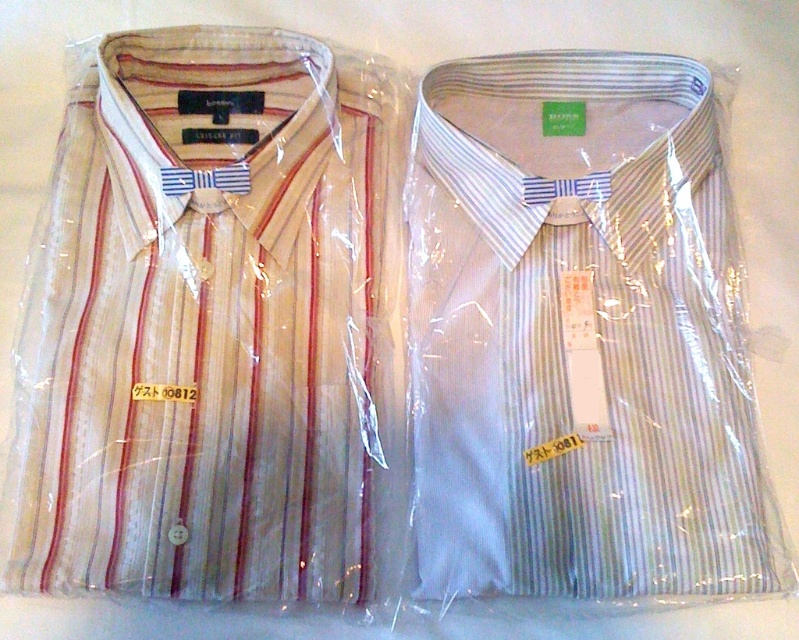
Question: Is white striped shirt at left bigger than light blue striped shirt at center?

Choices:
 (A) no
 (B) yes

Answer: (B)

Question: Is white striped shirt at left in front of light blue striped shirt at center?

Choices:
 (A) yes
 (B) no

Answer: (A)

Question: Which point is farther to the camera?

Choices:
 (A) (138, 516)
 (B) (464, 424)

Answer: (B)

Question: Is white striped shirt at left positioned at the back of light blue striped shirt at center?

Choices:
 (A) yes
 (B) no

Answer: (B)